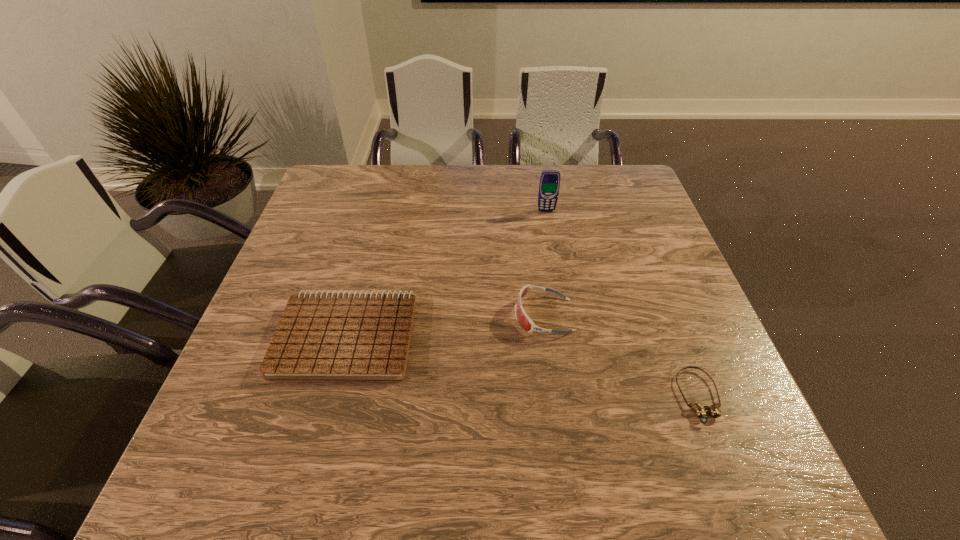
At what (x,y) coordinates should I click in order to perform the action: click on cellular telephone. Please return your answer as a coordinate pair (x, y). Looking at the image, I should click on (549, 184).

Identify the location of the tallest object. (549, 184).

Locate an element on the screen. This screenshot has height=540, width=960. the taller goggles is located at coordinates (525, 322).

Where is `the third shortest object`? the third shortest object is located at coordinates (525, 322).

At what (x,y) coordinates should I click in order to perform the action: click on the second shortest object. Please return your answer as a coordinate pair (x, y). The image size is (960, 540). Looking at the image, I should click on (321, 336).

This screenshot has width=960, height=540. In order to click on the leftmost object in this screenshot , I will do `click(321, 336)`.

Identify the location of the shorter goggles. (699, 409).

You are a GUI agent. You are given a task and a screenshot of the screen. Output one action in this format:
    pyautogui.click(x=<x>, y=<y>)
    Task: Click on the rightmost object
    The height and width of the screenshot is (540, 960).
    Given the screenshot: What is the action you would take?
    pyautogui.click(x=699, y=409)

This screenshot has width=960, height=540. I want to click on free space located 0.120m on the front-facing side of the farthest object, so click(x=551, y=239).

The image size is (960, 540). What are the coordinates of `vacant space located 0.050m on the front-facing side of the left goggles` in the screenshot? It's located at (492, 315).